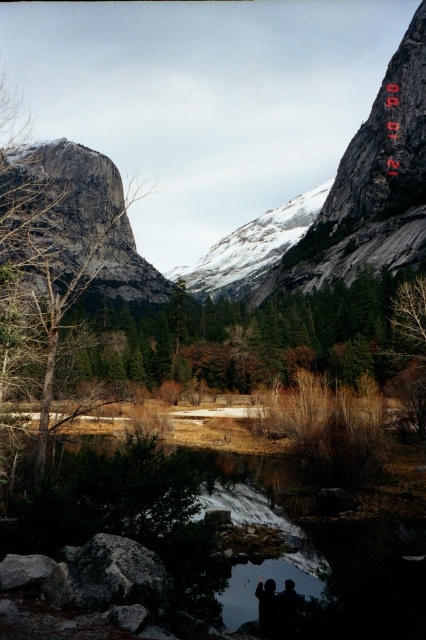
Question: Which of the following is the farthest from the observer?

Choices:
 (A) transparent glass puddle at lower center
 (B) brown matte tree at center

Answer: (B)

Question: Is gray granite mountain at center closer to camera compared to transparent glass puddle at lower center?

Choices:
 (A) yes
 (B) no

Answer: (B)

Question: Among these objects, which one is farthest from the camera?

Choices:
 (A) brown matte tree at center
 (B) transparent glass puddle at lower center
 (C) gray rock mountain at center

Answer: (C)

Question: Observing the image, what is the correct spatial positioning of gray rock mountain at center in reference to silhouette/shadow couple at lower center?

Choices:
 (A) below
 (B) above

Answer: (B)

Question: Observing the image, what is the correct spatial positioning of silhouette/shadow couple at lower center in reference to dark gray jacket at lower center?

Choices:
 (A) right
 (B) left

Answer: (A)

Question: Which object appears farthest from the camera in this image?

Choices:
 (A) transparent glass puddle at lower center
 (B) dark gray jacket at lower center
 (C) brown matte tree at center
 (D) gray granite mountain at center

Answer: (D)